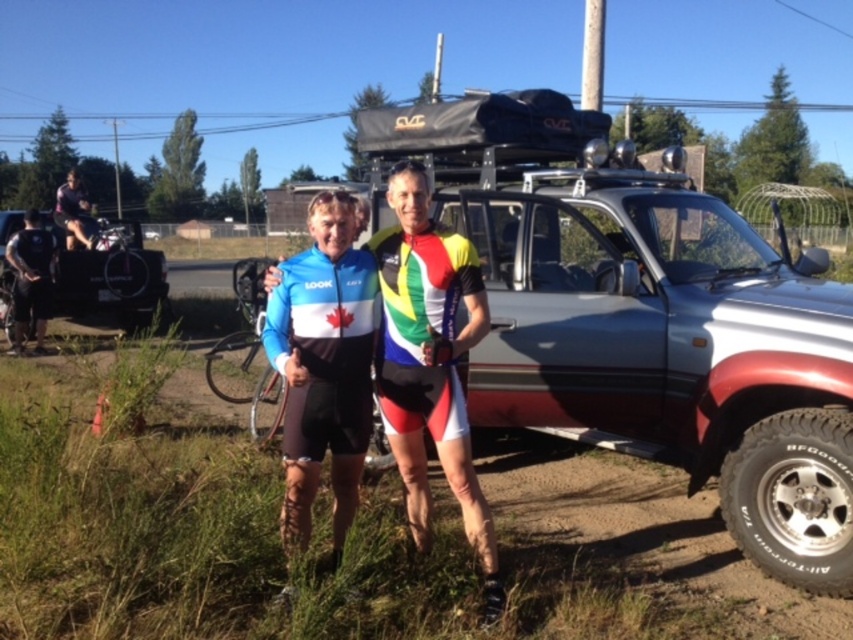
Question: Can you confirm if blue matte cycling jersey at center is thinner than brushed metal bicycle at left?

Choices:
 (A) no
 (B) yes

Answer: (B)

Question: Is brushed metal bicycle at left positioned in front of black matte uniform at left?

Choices:
 (A) yes
 (B) no

Answer: (B)

Question: Considering the relative positions of silver metallic pickup truck at center and brushed metal bicycle at left in the image provided, where is silver metallic pickup truck at center located with respect to brushed metal bicycle at left?

Choices:
 (A) left
 (B) right

Answer: (B)

Question: Among these points, which one is farthest from the camera?

Choices:
 (A) (473, 212)
 (B) (44, 346)
 (C) (405, 452)

Answer: (B)

Question: Based on their relative distances, which object is farther from the blue matte cycling jersey at center?

Choices:
 (A) black matte uniform at left
 (B) silver metallic pickup truck at center

Answer: (A)

Question: Which point is closer to the camera?

Choices:
 (A) blue matte cycling jersey at center
 (B) black matte uniform at left
 (C) silver metallic pickup truck at center
 (D) brushed metal bicycle at left

Answer: (A)